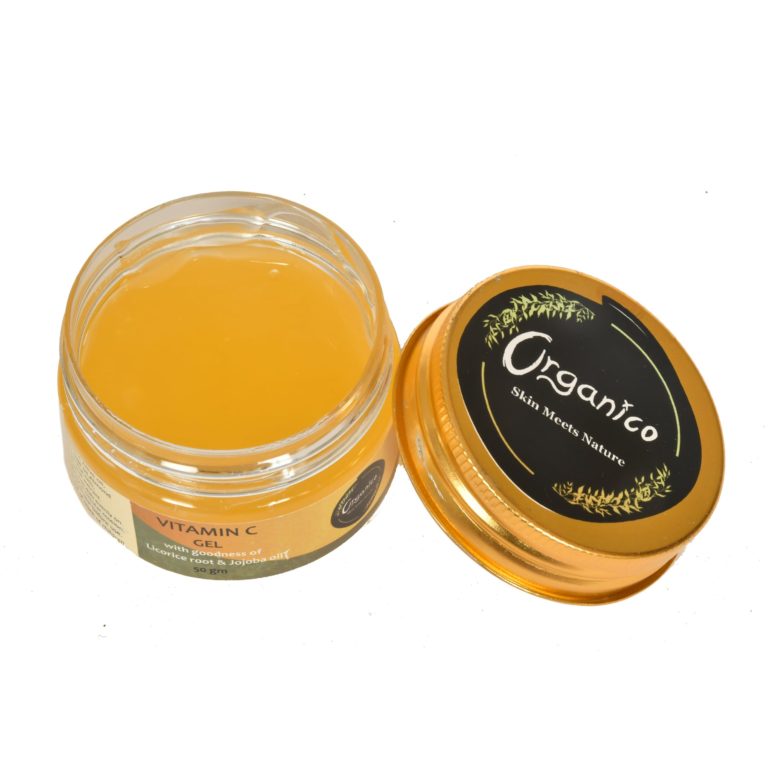
Find the location of a particular element. small jar is located at coordinates point(270,504).